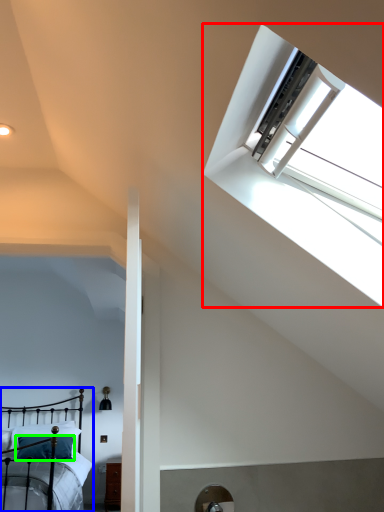
Question: Which object is the farthest from window (highlighted by a red box)? Choose among these: bed (highlighted by a blue box) or pillow (highlighted by a green box).

Choices:
 (A) bed
 (B) pillow

Answer: (B)